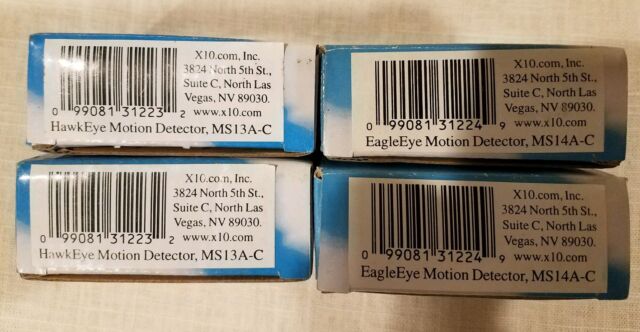
The width and height of the screenshot is (640, 332). Find the location of `boxes`. boxes is located at coordinates [297, 111], [340, 124], [291, 262], [326, 240].